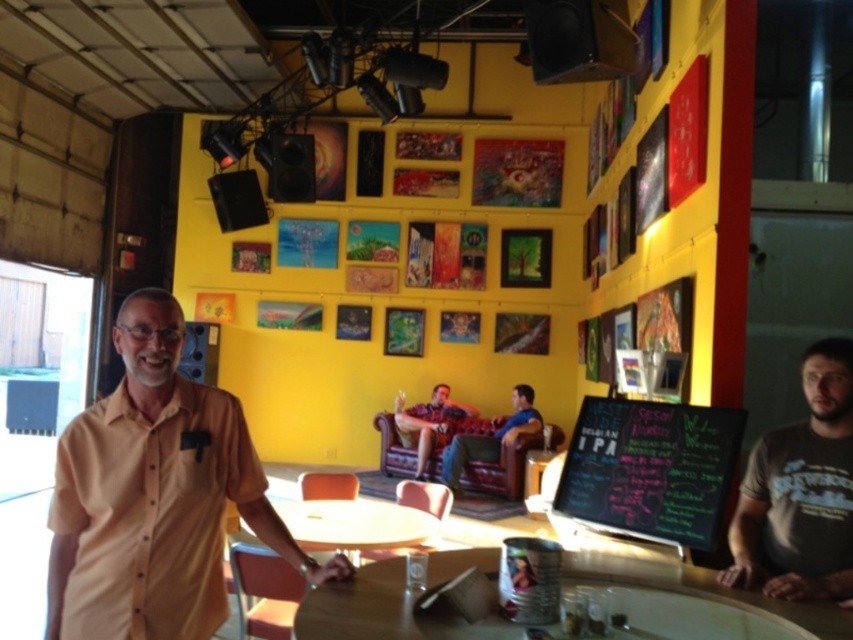
You are a person with a height of 1.7 meters standing at the point marked by the coordinate point at [657,444]. You want to reach the round wooden table where the man is standing. Can you comfortably walk to it without needing to bend down or move any obstacles?

The distance between you and the round wooden table is 3.26 meters. Since this distance is more than sufficient for a person of 1.7 meters to walk comfortably, you can reach the table without bending down or moving obstacles.

You are a customer in this cafe and want to write a message on the chalkboard at center. Can you reach it while standing at the yellow matte table at center?

The chalkboard at center is located above the yellow matte table at center, so it might be out of reach if the table is blocking access or if the chalkboard is too high. However, since the description doesn not specify height differences beyond location, it depends on the customer s height and whether they can reach over the table.